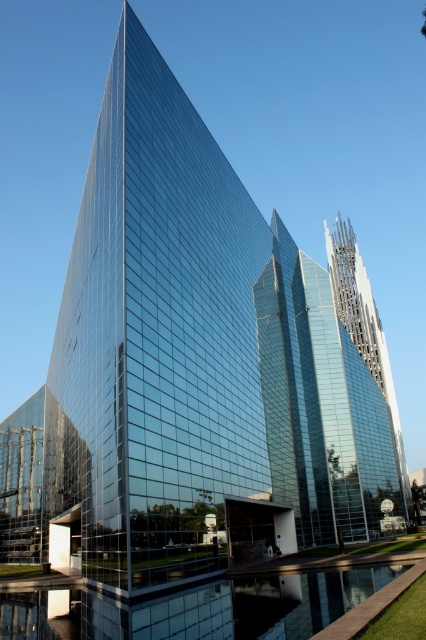
You are an architect designing a new park and want to place a statue between the transparent glass water at lower center and the clear glass tower at center. Based on their positions, where should the statue be placed?

The statue should be placed between the transparent glass water at lower center and the clear glass tower at center since the transparent glass water at lower center is positioned under the clear glass tower at center, indicating they are vertically aligned.

You are an architect evaluating the layout of this modern complex. You notice the transparent glass water at lower center and the clear glass tower at center. Which of these two elements takes up more visual space in the composition?

The clear glass tower at center occupies more visual space than the transparent glass water at lower center, as stated in the description.